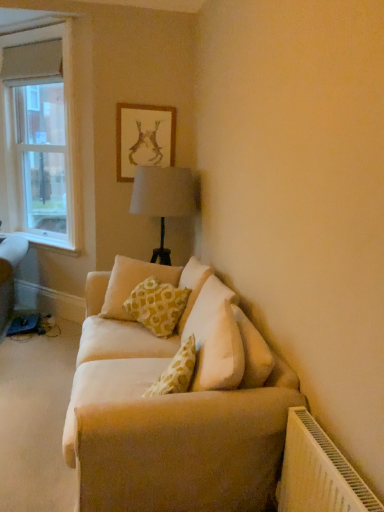
Question: Considering the relative sizes of clear glass window at left and yellow printed cushion at center in the image provided, is clear glass window at left bigger than yellow printed cushion at center?

Choices:
 (A) yes
 (B) no

Answer: (A)

Question: Can you confirm if clear glass window at left is taller than yellow printed cushion at center?

Choices:
 (A) yes
 (B) no

Answer: (A)

Question: From the image's perspective, does clear glass window at left appear lower than yellow printed cushion at center?

Choices:
 (A) no
 (B) yes

Answer: (A)

Question: Is the surface of clear glass window at left in direct contact with yellow printed cushion at center?

Choices:
 (A) no
 (B) yes

Answer: (A)

Question: From the image's perspective, is clear glass window at left above yellow printed cushion at center?

Choices:
 (A) no
 (B) yes

Answer: (B)

Question: Is beige fabric couch at center in front of or behind gold-framed artwork at upper center in the image?

Choices:
 (A) front
 (B) behind

Answer: (A)

Question: In the image, is beige fabric couch at center on the left side or the right side of gold-framed artwork at upper center?

Choices:
 (A) right
 (B) left

Answer: (B)

Question: Based on their sizes in the image, would you say beige fabric couch at center is bigger or smaller than gold-framed artwork at upper center?

Choices:
 (A) big
 (B) small

Answer: (A)

Question: From a real-world perspective, relative to gold-framed artwork at upper center, is beige fabric couch at center vertically above or below?

Choices:
 (A) above
 (B) below

Answer: (B)

Question: From the image's perspective, is beige fabric couch at center positioned above or below white wood at left?

Choices:
 (A) below
 (B) above

Answer: (A)

Question: Is beige fabric couch at center in front of or behind white wood at left in the image?

Choices:
 (A) front
 (B) behind

Answer: (A)

Question: Considering the positions of beige fabric couch at center and white wood at left in the image, is beige fabric couch at center wider or thinner than white wood at left?

Choices:
 (A) wide
 (B) thin

Answer: (A)

Question: Is beige fabric couch at center taller or shorter than white wood at left?

Choices:
 (A) short
 (B) tall

Answer: (A)

Question: Is gold-framed artwork at upper center situated inside beige fabric couch at center or outside?

Choices:
 (A) outside
 (B) inside

Answer: (A)

Question: In terms of size, does gold-framed artwork at upper center appear bigger or smaller than beige fabric couch at center?

Choices:
 (A) small
 (B) big

Answer: (A)